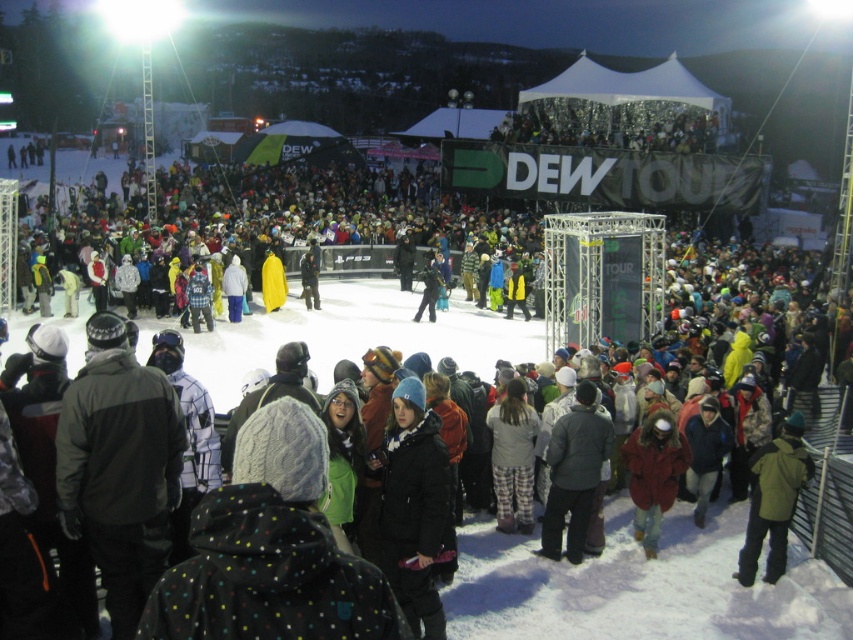
Is point (422, 566) positioned before point (564, 484)?

Yes.

Does point (416, 608) lie behind point (572, 452)?

No, it is in front of (572, 452).

Who is more distant from viewer, (x=409, y=604) or (x=605, y=454)?

Positioned behind is point (x=605, y=454).

You are a GUI agent. You are given a task and a screenshot of the screen. Output one action in this format:
    pyautogui.click(x=<x>, y=<y>)
    Task: Click on the black matte jacket at center
    Image resolution: width=853 pixels, height=640 pixels.
    Given the screenshot: What is the action you would take?
    pyautogui.click(x=413, y=508)

Does dark gray jacket at center have a greater width compared to red fur-lined coat at center?

Yes, dark gray jacket at center is wider than red fur-lined coat at center.

Who is more forward, (x=567, y=550) or (x=647, y=474)?

Point (x=567, y=550) is in front.

Where is `dark gray jacket at center`? The height and width of the screenshot is (640, 853). dark gray jacket at center is located at coordinates (573, 474).

The image size is (853, 640). Find the location of `dark gray jacket at center`. dark gray jacket at center is located at coordinates (573, 474).

Does black matte jacket at center come in front of green matte jacket at lower right?

That is True.

Is black matte jacket at center positioned at the back of green matte jacket at lower right?

No, it is in front of green matte jacket at lower right.

Where is `black matte jacket at center`? Image resolution: width=853 pixels, height=640 pixels. black matte jacket at center is located at coordinates (413, 508).